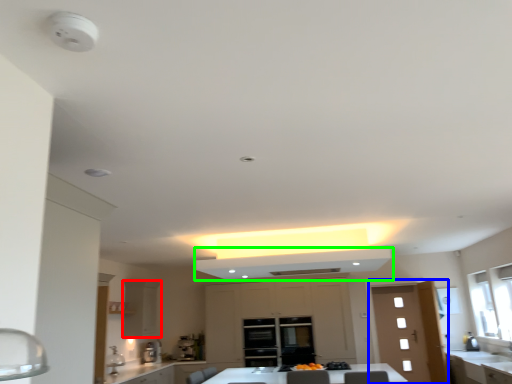
Question: Which is farther away from cabinetry (highlighted by a red box)? door (highlighted by a blue box) or exhaust hood (highlighted by a green box)?

Choices:
 (A) door
 (B) exhaust hood

Answer: (A)